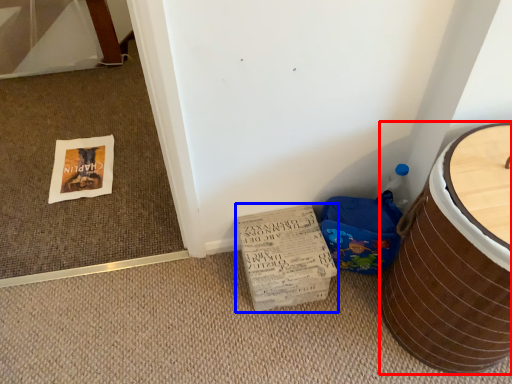
Question: Which object is further to the camera taking this photo, furniture (highlighted by a red box) or cardboard (highlighted by a blue box)?

Choices:
 (A) furniture
 (B) cardboard

Answer: (B)